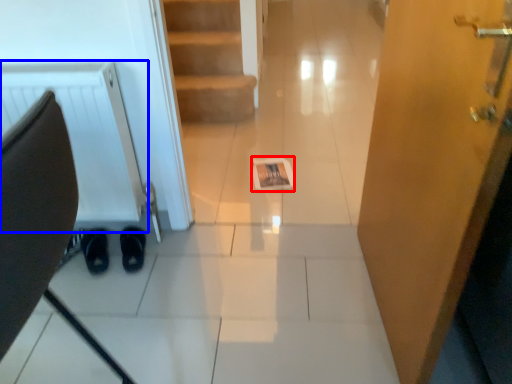
Question: Which point is further to the camera, magazine (highlighted by a red box) or radiator (highlighted by a blue box)?

Choices:
 (A) magazine
 (B) radiator

Answer: (A)